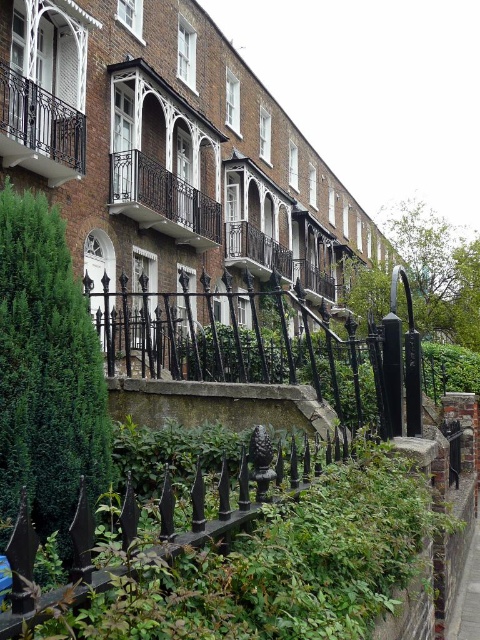
Question: Can you confirm if green leafy hedge at lower left is positioned to the left of concrete pavement at lower right?

Choices:
 (A) no
 (B) yes

Answer: (B)

Question: Which of the following is the farthest from the observer?

Choices:
 (A) black wrought iron balcony at upper left
 (B) green leafy hedge at lower left

Answer: (A)

Question: Estimate the real-world distances between objects in this image. Which object is closer to the green leafy hedge at lower left?

Choices:
 (A) concrete pavement at lower right
 (B) dark brown wrought iron balcony at center

Answer: (A)

Question: Is green leafy hedge at lower left to the left of concrete pavement at lower right from the viewer's perspective?

Choices:
 (A) no
 (B) yes

Answer: (B)

Question: Which object is positioned closest to the black wrought iron balcony at upper left?

Choices:
 (A) green leafy hedge at lower left
 (B) dark brown wrought iron balcony at center

Answer: (B)

Question: Can you confirm if black wrought iron balcony at upper left is smaller than dark brown wrought iron balcony at center?

Choices:
 (A) yes
 (B) no

Answer: (B)